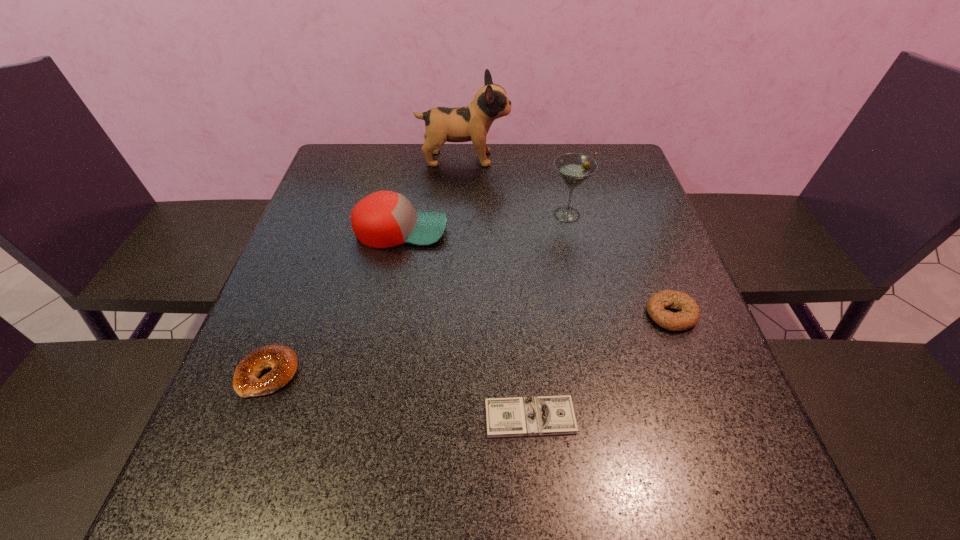
The image size is (960, 540). Find the location of `free space located at the face of the puppy`. free space located at the face of the puppy is located at coordinates (599, 159).

Where is `vacant region located 0.080m on the front of the fifth object from left to right`? vacant region located 0.080m on the front of the fifth object from left to right is located at coordinates (575, 249).

Where is `blank area located at the brim of the baseball cap`? blank area located at the brim of the baseball cap is located at coordinates (602, 230).

Where is `vacant space situated 0.320m on the right of the leftmost object`? This screenshot has width=960, height=540. vacant space situated 0.320m on the right of the leftmost object is located at coordinates (472, 374).

Where is `blank space located on the left of the rightmost object`? blank space located on the left of the rightmost object is located at coordinates (617, 314).

You are a GUI agent. You are given a task and a screenshot of the screen. Output one action in this format:
    pyautogui.click(x=<x>, y=<y>)
    Task: Click on the free point located 0.240m on the back of the shortest object
    
    Given the screenshot: What is the action you would take?
    pyautogui.click(x=520, y=296)

This screenshot has width=960, height=540. Find the location of `object situated at the far edge`. object situated at the far edge is located at coordinates (468, 123).

Where is `baseball cap that is at the left edge`? This screenshot has height=540, width=960. baseball cap that is at the left edge is located at coordinates (383, 219).

At what (x,y) coordinates should I click in order to perform the action: click on bagel located in the left edge section of the desktop. Please return your answer as a coordinate pair (x, y). This screenshot has width=960, height=540. Looking at the image, I should click on (282, 360).

In order to click on object present at the right edge in this screenshot , I will do `click(689, 316)`.